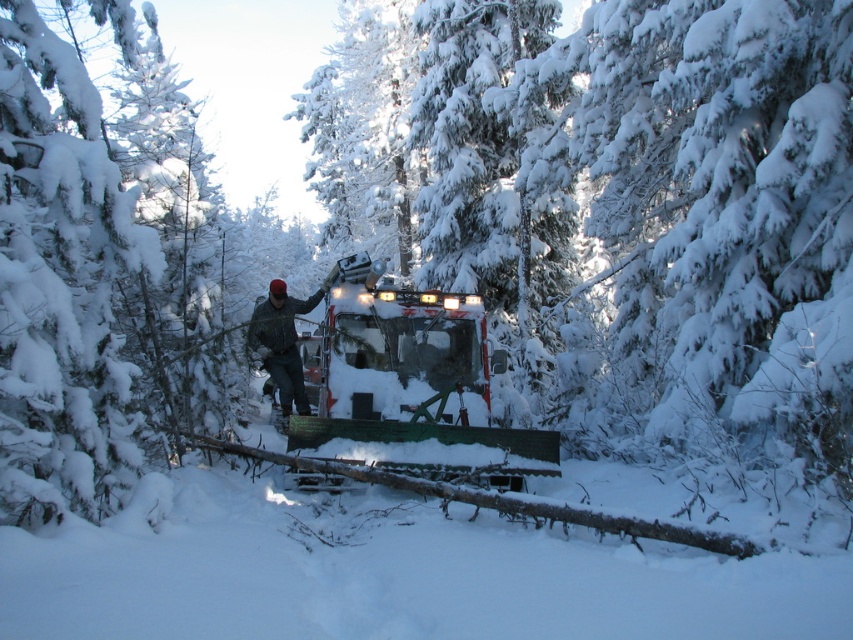
Which of these two, snow-covered pine tree at left or camouflage jacket at center, stands shorter?

Standing shorter between the two is snow-covered pine tree at left.

Does snow-covered pine tree at left have a lesser width compared to camouflage jacket at center?

Yes, snow-covered pine tree at left is thinner than camouflage jacket at center.

Does point (22, 276) lie behind point (274, 340)?

That is False.

Where is `snow-covered pine tree at left`? This screenshot has height=640, width=853. snow-covered pine tree at left is located at coordinates (61, 284).

Is metallic silver snowmobile at center smaller than camouflage jacket at center?

No.

Who is taller, metallic silver snowmobile at center or camouflage jacket at center?

metallic silver snowmobile at center

Is point (456, 342) more distant than point (259, 333)?

No, it is in front of (259, 333).

You are a GUI agent. You are given a task and a screenshot of the screen. Output one action in this format:
    pyautogui.click(x=<x>, y=<y>)
    Task: Click on the metallic silver snowmobile at center
    The image size is (853, 640).
    Given the screenshot: What is the action you would take?
    pyautogui.click(x=410, y=385)

Which is more to the left, snow-covered pine tree at left or metallic silver snowmobile at center?

snow-covered pine tree at left

Does point (9, 509) come closer to viewer compared to point (410, 401)?

Yes, point (9, 509) is closer to viewer.

Is point (109, 221) closer to viewer compared to point (343, 372)?

Yes, it is in front of point (343, 372).

This screenshot has height=640, width=853. I want to click on snow-covered pine tree at left, so click(61, 284).